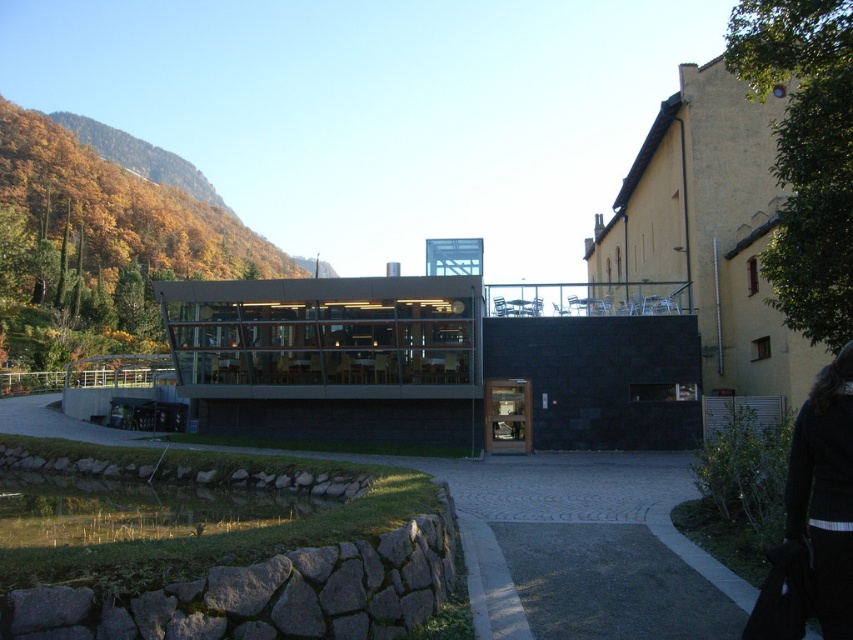
Who is positioned more to the left, paved stone path at center or black fabric at lower right?

Positioned to the left is paved stone path at center.

Who is more distant from viewer, (666, 595) or (848, 602)?

The point (666, 595) is behind.

Does point (576, 618) lie behind point (811, 525)?

Yes, point (576, 618) is farther from viewer.

The width and height of the screenshot is (853, 640). Identify the location of paved stone path at center. (582, 547).